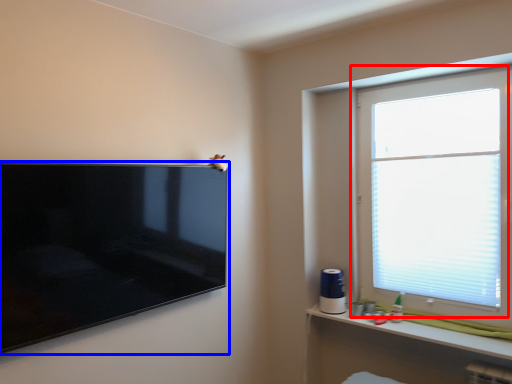
Question: Which object is closer to the camera taking this photo, window (highlighted by a red box) or television (highlighted by a blue box)?

Choices:
 (A) window
 (B) television

Answer: (B)